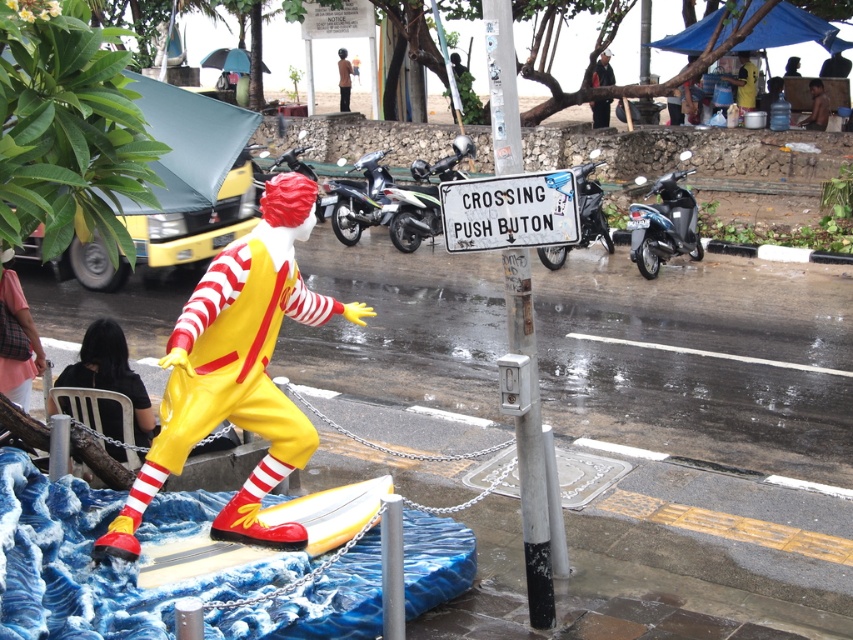
Question: Which point is closer to the camera?

Choices:
 (A) (413, 241)
 (B) (816, 108)
 (C) (109, 368)

Answer: (C)

Question: Is white glossy motorcycle at center further to camera compared to shiny black motorcycle at center?

Choices:
 (A) no
 (B) yes

Answer: (A)

Question: Which is nearer to the white painted metal at center?

Choices:
 (A) dark gray fabric jacket at upper center
 (B) black fabric person at lower left

Answer: (B)

Question: Observing the image, what is the correct spatial positioning of white painted metal at center in reference to skinny man at upper right?

Choices:
 (A) left
 (B) right

Answer: (A)

Question: Which of the following is the farthest from the observer?

Choices:
 (A) (590, 106)
 (B) (364, 211)
 (C) (62, 403)
 (D) (294, 417)

Answer: (A)

Question: Is white painted metal at center thinner than skinny man at upper right?

Choices:
 (A) yes
 (B) no

Answer: (B)